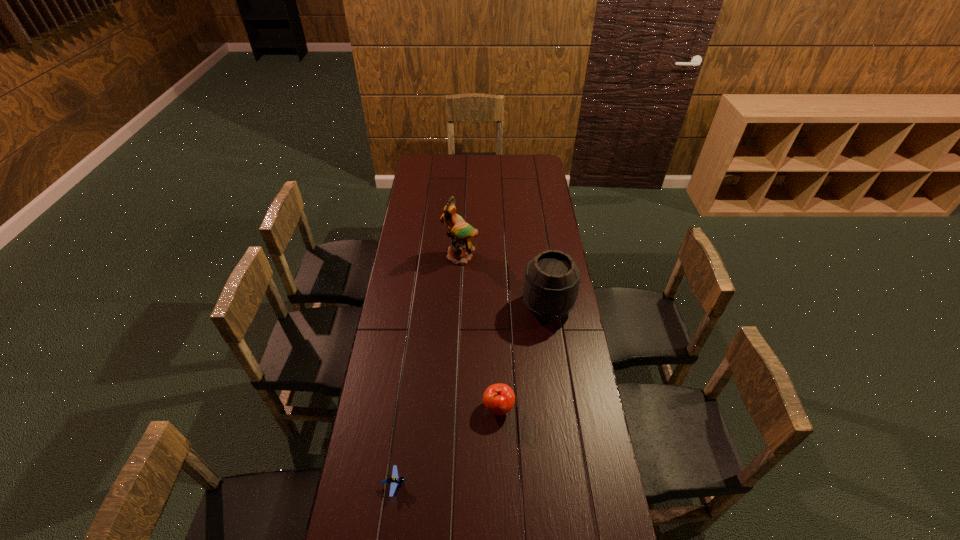
Image resolution: width=960 pixels, height=540 pixels. Identify the location of blank space located 0.180m on the front of the apple. (500, 476).

You are a GUI agent. You are given a task and a screenshot of the screen. Output one action in this format:
    pyautogui.click(x=<x>, y=<y>)
    Task: Click on the free space located on the front-facing side of the leftmost object
    
    Given the screenshot: What is the action you would take?
    pyautogui.click(x=458, y=484)

Find the location of a particular element. The width and height of the screenshot is (960, 540). object that is at the left edge is located at coordinates (394, 481).

The image size is (960, 540). Find the location of `object that is at the right edge`. object that is at the right edge is located at coordinates (551, 284).

The image size is (960, 540). Identify the location of vacant space at the left edge of the desktop. (395, 315).

You are a GUI agent. You are given a task and a screenshot of the screen. Output one action in this format:
    pyautogui.click(x=<x>, y=<y>)
    Task: Click on the vacant space at the right edge
    The height and width of the screenshot is (540, 960).
    Given the screenshot: What is the action you would take?
    pyautogui.click(x=537, y=208)

Image resolution: width=960 pixels, height=540 pixels. I want to click on vacant region at the far left corner of the desktop, so point(418,156).

This screenshot has height=540, width=960. I want to click on free space at the far right corner of the desktop, so click(x=525, y=156).

Image resolution: width=960 pixels, height=540 pixels. I want to click on vacant area that lies between the farthest object and the leftmost object, so click(427, 370).

Locate an element on the screen. blank region between the wine bucket and the third object from right to left is located at coordinates (504, 282).